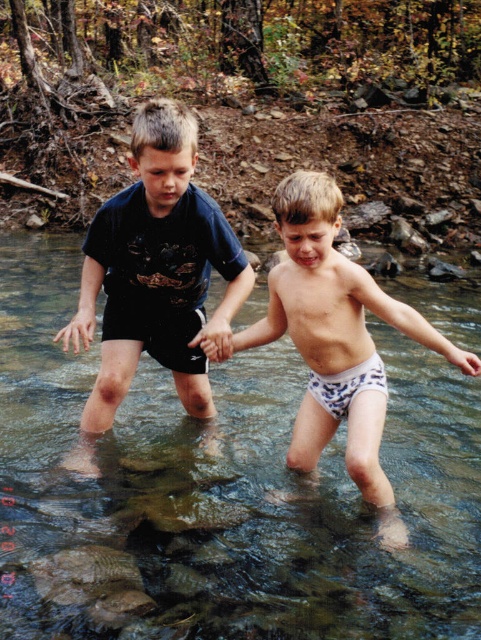
You are a photographer standing at the edge of the stream. You want to take a photo of both the dark blue cotton shorts at center and the white printed shorts at center in the same frame. The minimum distance your camera can focus on two objects is 50 centimeters apart. Will both pairs of shorts be in focus?

The distance between the dark blue cotton shorts at center and white printed shorts at center is 64.39 centimeters, which exceeds the minimum focus distance requirement of 50 centimeters. Therefore, both pairs of shorts will be in focus in the photo.

You are standing at the point with coordinates point [90,460] and want to walk to the point with coordinates point [8,362]. Which direction should you face to move towards it?

You should face north because point [8,362] is behind point [90,460].